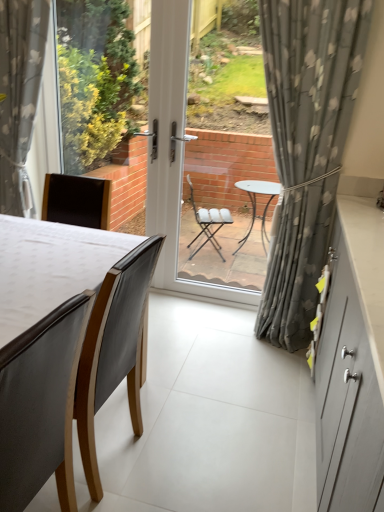
Identify the location of empty space that is to the right of matte black chair at left, which ranks as the first chair in back-to-front order. The width and height of the screenshot is (384, 512). (190, 462).